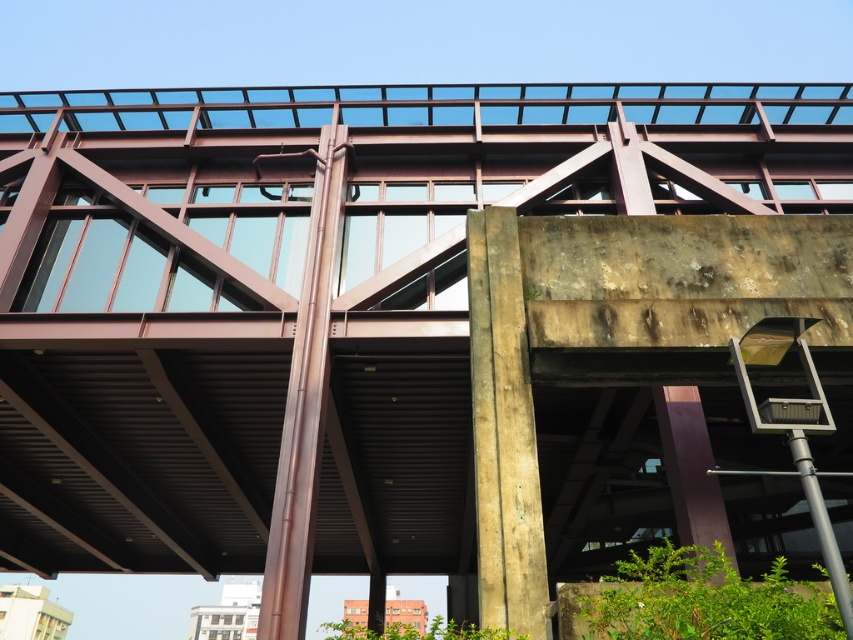
Question: Does brown metallic pipe at center appear on the left side of purple glossy pillar at lower right?

Choices:
 (A) yes
 (B) no

Answer: (A)

Question: Which object is positioned farthest from the purple glossy pillar at lower right?

Choices:
 (A) brown metallic pipe at center
 (B) concrete textured pillar at center

Answer: (A)

Question: Which object appears farthest from the camera in this image?

Choices:
 (A) concrete textured pillar at center
 (B) brown metallic pipe at center
 (C) purple glossy pillar at lower right

Answer: (C)

Question: Does brown metallic pipe at center appear over purple glossy pillar at lower right?

Choices:
 (A) yes
 (B) no

Answer: (A)

Question: Among these objects, which one is farthest from the camera?

Choices:
 (A) concrete textured pillar at center
 (B) purple glossy pillar at lower right
 (C) brown metallic pipe at center

Answer: (B)

Question: Is brown metallic pipe at center to the left of purple glossy pillar at lower right from the viewer's perspective?

Choices:
 (A) no
 (B) yes

Answer: (B)